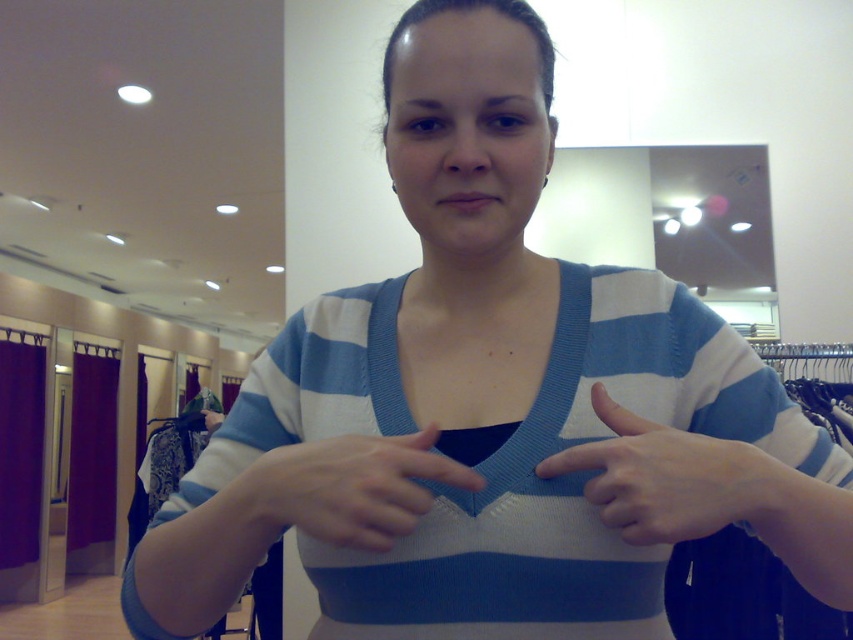
Consider the image. You are a tailor working on a custom sweater. You need to ensure that the white knitted hand at center can comfortably reach the white matte fabric at center without straining. Given that the minimum comfortable reach distance for a hand to fabric is 4.5 inches, is the current distance sufficient?

The distance between the white knitted hand at center and the white matte fabric at center is 5.10 inches, which exceeds the minimum comfortable reach distance of 4.5 inches. Therefore, the current distance allows comfortable reach without straining.

Based on the photo, you are a customer in a clothing store trying to examine a sweater. You see the white matte fabric at center and the white knitted hand at center. Which object is located higher up?

The white matte fabric at center is above the white knitted hand at center, so the white matte fabric at center is higher up.

You are a photographer adjusting the focus on your camera. You notice two points in the image at coordinates point (741, 444) and point (267, 458). Which point should you focus on first if you want to ensure the closest object is in sharp focus?

You should focus on point (741, 444) first because it is closer to the camera than point (267, 458), ensuring the closest object is in sharp focus.